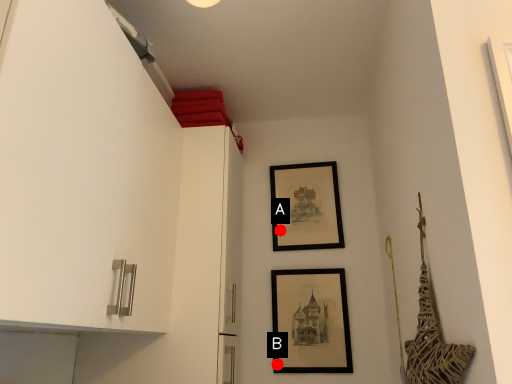
Question: Two points are circled on the image, labeled by A and B beside each circle. Which point is closer to the camera?

Choices:
 (A) A is closer
 (B) B is closer

Answer: (B)